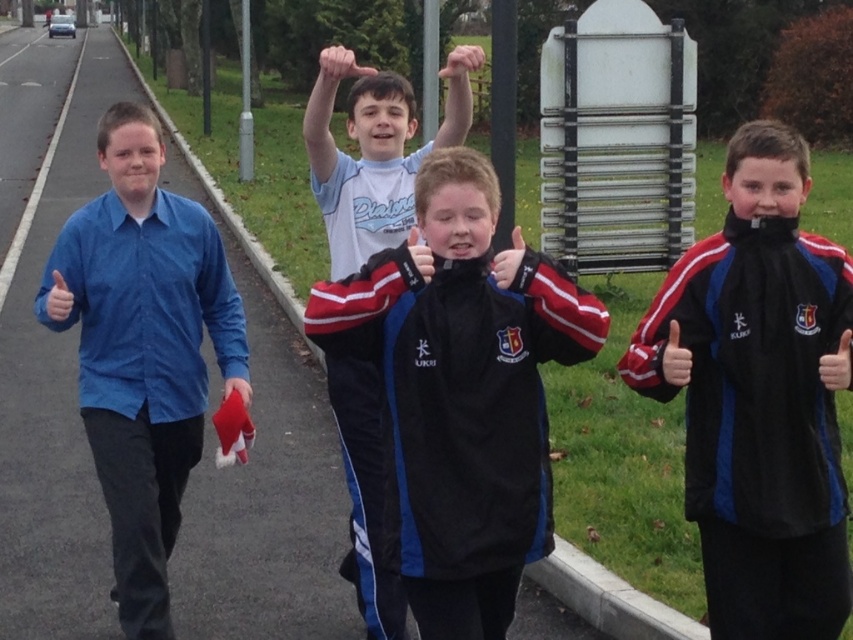
Is point (114, 467) less distant than point (457, 58)?

That is False.

The width and height of the screenshot is (853, 640). I want to click on blue cotton shirt at left, so click(143, 349).

Does velvet black jacket at center appear over black velour jacket at right?

No, velvet black jacket at center is not above black velour jacket at right.

Which is more to the right, velvet black jacket at center or black velour jacket at right?

Positioned to the right is black velour jacket at right.

Is point (463, 164) positioned behind point (732, 256)?

No, (463, 164) is closer to viewer.

Where is `velvet black jacket at center`? velvet black jacket at center is located at coordinates (461, 392).

Describe the element at coordinates (461, 392) in the screenshot. I see `velvet black jacket at center` at that location.

Find the location of a particular element. velvet black jacket at center is located at coordinates (461, 392).